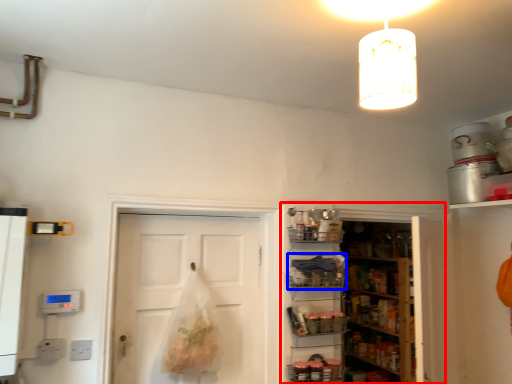
Question: Among these objects, which one is farthest to the camera, cabinetry (highlighted by a red box) or shelf (highlighted by a blue box)?

Choices:
 (A) cabinetry
 (B) shelf

Answer: (A)